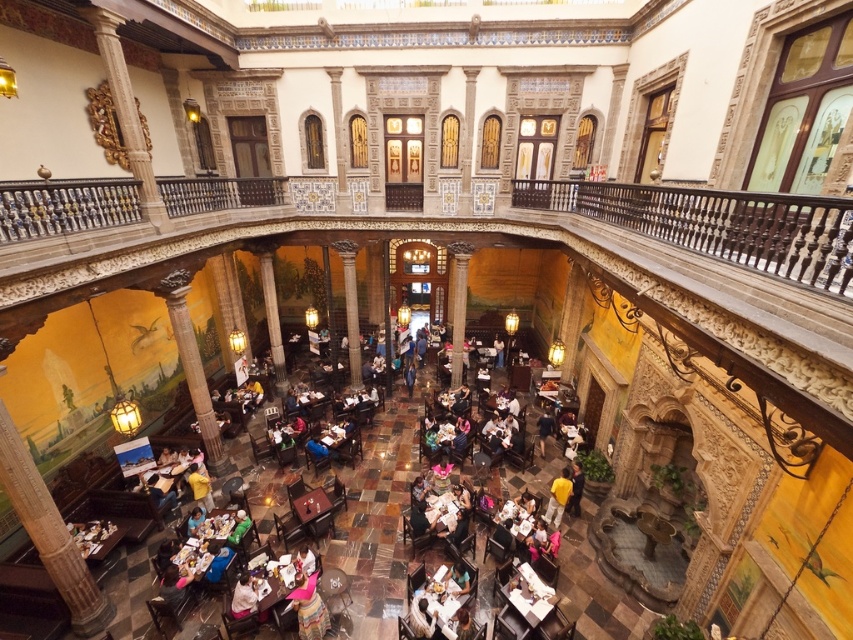
You are a guest at this venue and want to sit at the table where the pink fabric at lower center and dark blue shirt at center are visible. Which object would you see first when looking down from the table?

The dark blue shirt at center is located above the pink fabric at lower center, so you would see it first when looking down from the table.

You are a guest at this venue and notice two shirts on a chair in the dining area. The yellow matte shirt at center and the white fabric shirt at lower center. Which shirt is placed higher on the chair?

The yellow matte shirt at center is placed higher on the chair than the white fabric shirt at lower center.